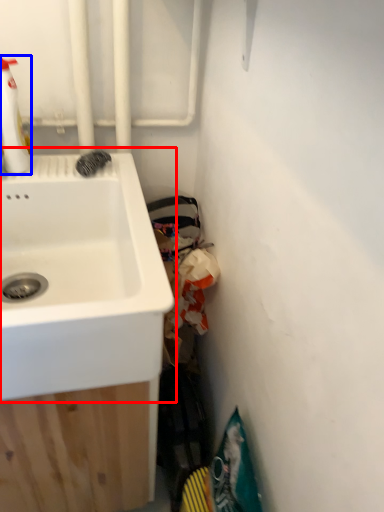
Question: Which point is further to the camera, sink (highlighted by a red box) or cleaning product (highlighted by a blue box)?

Choices:
 (A) sink
 (B) cleaning product

Answer: (B)